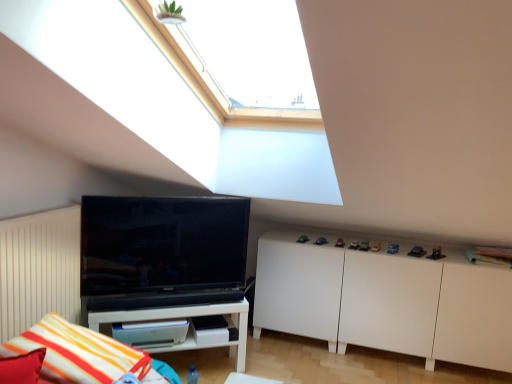
Question: Based on their positions, is striped fabric pillow at lower left located to the left or right of black glossy tv at left?

Choices:
 (A) right
 (B) left

Answer: (B)

Question: From a real-world perspective, is striped fabric pillow at lower left physically located above or below black glossy tv at left?

Choices:
 (A) below
 (B) above

Answer: (A)

Question: Estimate the real-world distances between objects in this image. Which object is farther from the white matte cabinet at lower right?

Choices:
 (A) black glossy tv at left
 (B) striped fabric pillow at lower left
 (C) white glossy shelf at lower left

Answer: (B)

Question: Estimate the real-world distances between objects in this image. Which object is closer to the white glossy shelf at lower left?

Choices:
 (A) striped fabric pillow at lower left
 (B) white matte cabinet at lower right
 (C) black glossy tv at left

Answer: (C)